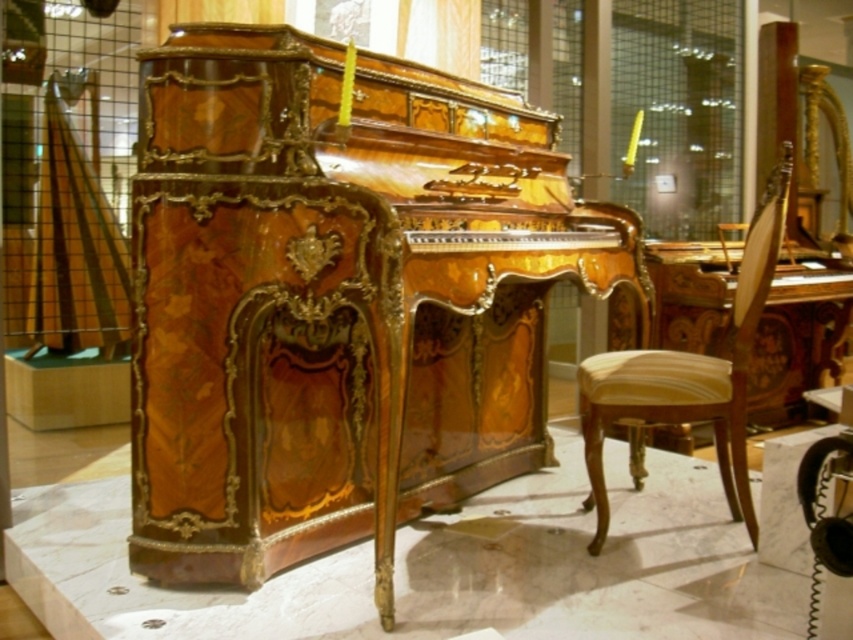
You are standing in front of an antique piano in a museum. There is a point marked at coordinates (x=338, y=298). Based on the scene description, can you determine which object this point belongs to?

The point at coordinates (x=338, y=298) is on the glossy wood piano at center.

You are a museum visitor standing in front of the glossy wood piano at center and the yellow upholstered chair at center. Which object is located to the right side of the other?

The yellow upholstered chair at center is located to the right of the glossy wood piano at center because the glossy wood piano at center is positioned on the left side of the yellow upholstered chair at center.

You are an interior designer assessing the space for a new sculpture. You see the glossy wood piano at center and the wooden pillar at center. Which object is taller?

The glossy wood piano at center is much taller than the wooden pillar at center according to the description.